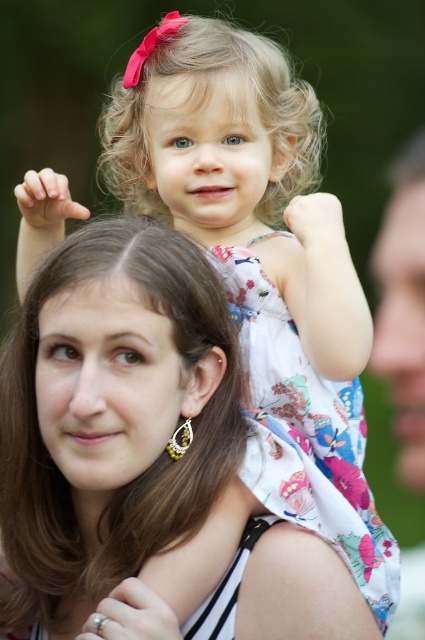
Who is lower down, brown smooth hair at center or smooth skin arm at upper center?

→ brown smooth hair at center is below.

Can you confirm if brown smooth hair at center is positioned to the right of smooth skin arm at upper center?

No, brown smooth hair at center is not to the right of smooth skin arm at upper center.

Is point (159, 243) farther from viewer compared to point (342, 243)?

No.

Identify the location of brown smooth hair at center. This screenshot has width=425, height=640. (119, 428).

Who is positioned more to the left, smooth skin face at right or light skin tone flesh at upper left?

light skin tone flesh at upper left is more to the left.

Does point (404, 228) come closer to viewer compared to point (17, 188)?

Yes, point (404, 228) is in front of point (17, 188).

Image resolution: width=425 pixels, height=640 pixels. What are the coordinates of `smooth skin face at right` in the screenshot? It's located at point(402,307).

Who is more distant from viewer, (x=189, y=278) or (x=42, y=189)?

Positioned behind is point (x=42, y=189).

Does brown smooth hair at center come in front of light skin tone flesh at upper left?

Yes, it is in front of light skin tone flesh at upper left.

Is point (197, 596) farther from camera compared to point (27, 259)?

That is False.

You are a GUI agent. You are given a task and a screenshot of the screen. Output one action in this format:
    pyautogui.click(x=<x>, y=<y>)
    Task: Click on the brown smooth hair at center
    The height and width of the screenshot is (640, 425).
    Given the screenshot: What is the action you would take?
    pyautogui.click(x=119, y=428)